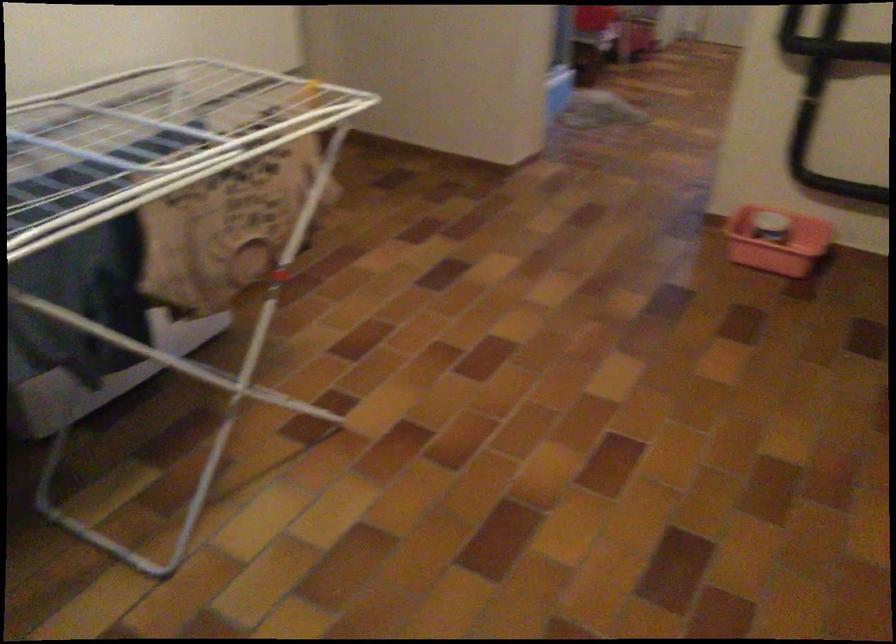
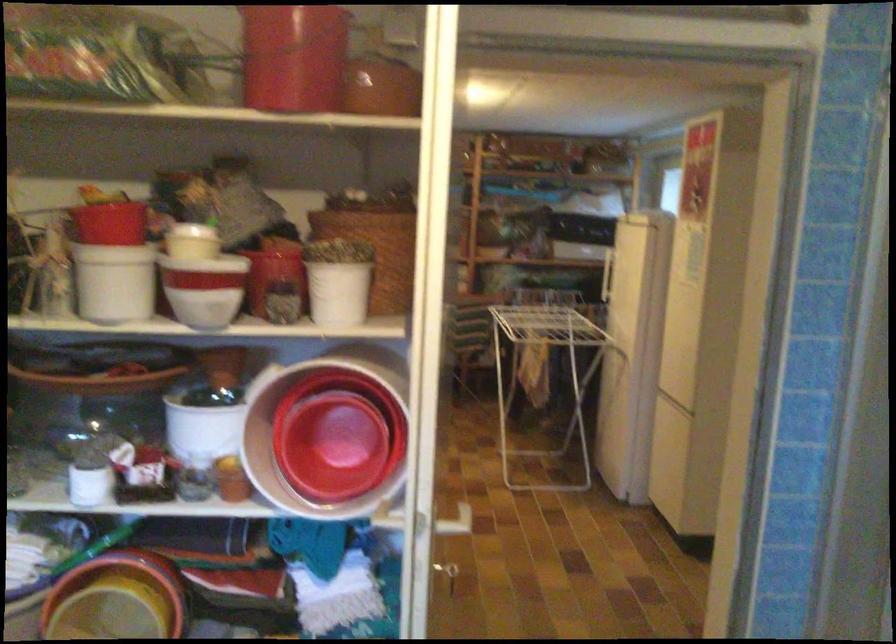
Locate, in the second image, the point that corresponds to the point at 306,173 in the first image.

(545, 375)